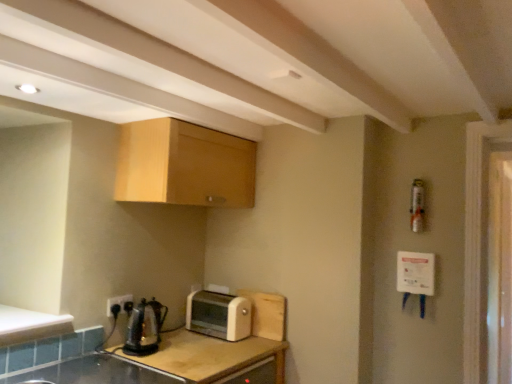
Question: Is point (35, 322) closer or farther from the camera than point (130, 309)?

Choices:
 (A) farther
 (B) closer

Answer: (B)

Question: Based on their sizes in the image, would you say white matte counter top at lower left is bigger or smaller than shiny metallic kettle at lower left?

Choices:
 (A) small
 (B) big

Answer: (A)

Question: Which of these objects is positioned closest to the transparent glass screen door at right?

Choices:
 (A) white matte counter top at lower left
 (B) wooden at lower left
 (C) shiny metallic kettle at lower left
 (D) beige plastic toaster at center
 (E) light wood cabinet at upper center

Answer: (D)

Question: Which is farther from the black plastic electric outlet at lower left?

Choices:
 (A) beige plastic toaster at center
 (B) wooden at lower left
 (C) light wood cabinet at upper center
 (D) transparent glass screen door at right
 (E) white matte counter top at lower left

Answer: (D)